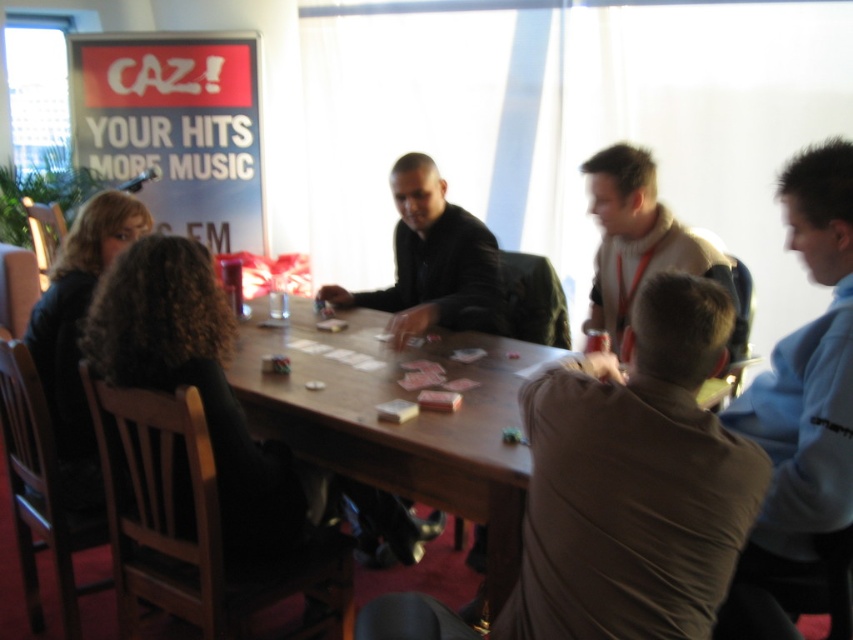
Question: Does wooden at center have a greater width compared to black leather jacket at center?

Choices:
 (A) yes
 (B) no

Answer: (A)

Question: Is black leather jacket at center smaller than light beige sweater at center?

Choices:
 (A) no
 (B) yes

Answer: (A)

Question: In this image, where is wooden at center located relative to black leather jacket at center?

Choices:
 (A) below
 (B) above

Answer: (A)

Question: Estimate the real-world distances between objects in this image. Which object is closer to the black leather jacket at center?

Choices:
 (A) wooden at center
 (B) light beige sweater at center

Answer: (A)

Question: Among these points, which one is farthest from the camera?

Choices:
 (A) click(x=612, y=268)
 (B) click(x=430, y=296)

Answer: (B)

Question: Among these objects, which one is farthest from the camera?

Choices:
 (A) black leather jacket at center
 (B) light beige sweater at center
 (C) wooden at center

Answer: (A)